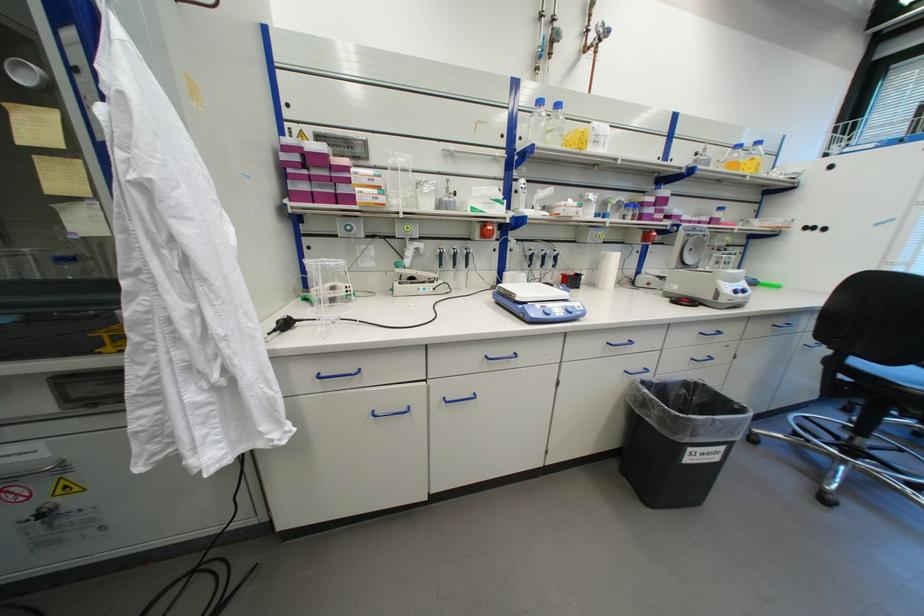
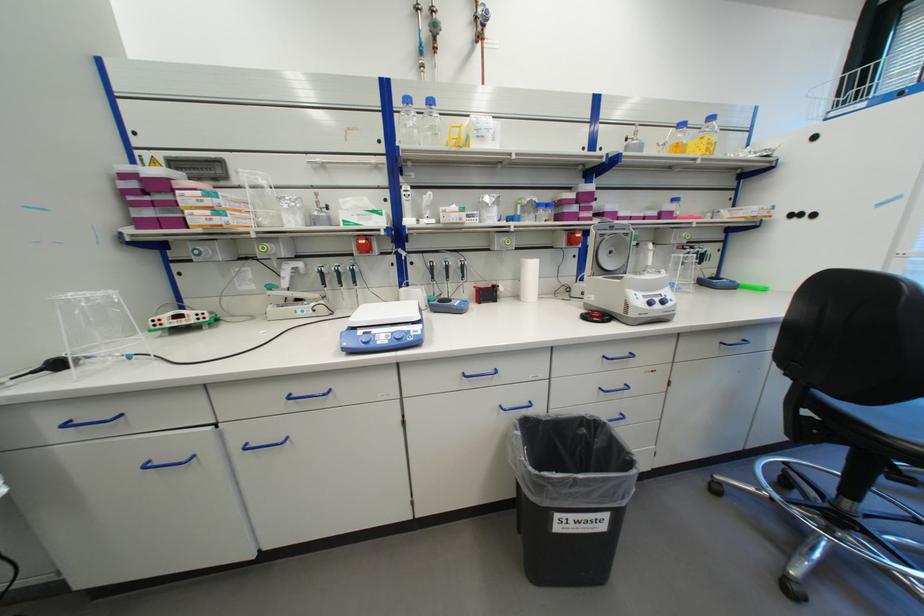
Find the pixel in the second image that matches point (545, 306) in the first image.

(369, 333)